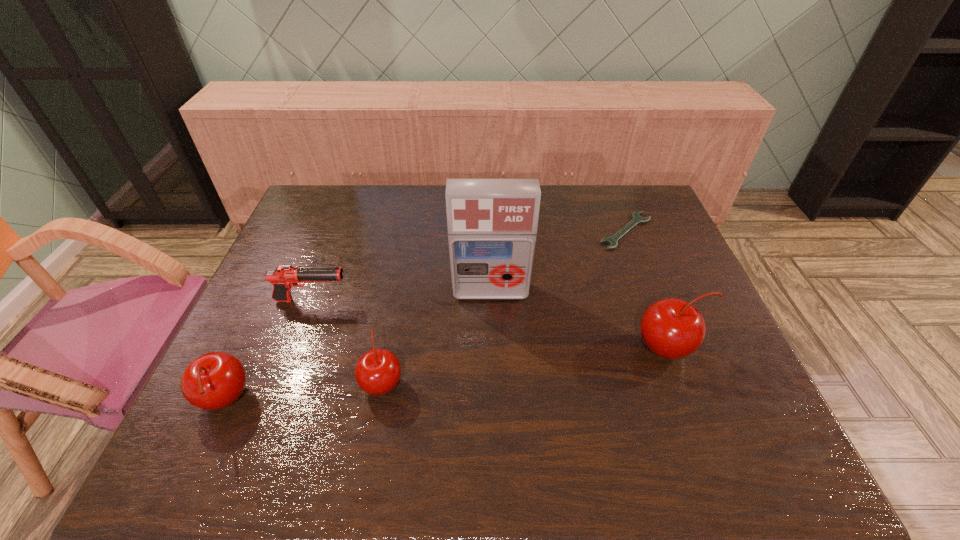
This screenshot has width=960, height=540. I want to click on cherry identified as the second closest to the gun, so click(215, 380).

Find the location of a particular element. Image resolution: width=960 pixels, height=540 pixels. vacant area that satisfies the following two spatial constraints: 1. at the aiming end of the gun; 2. on the left side of the rightmost cherry is located at coordinates (x=294, y=348).

Find the location of a particular element. free spot that satisfies the following two spatial constraints: 1. at the aiming end of the gun; 2. on the right side of the rightmost cherry is located at coordinates (294, 348).

I want to click on free space that satisfies the following two spatial constraints: 1. at the aiming end of the shortest cherry; 2. on the left side of the gun, so click(x=281, y=382).

Find the location of a particular element. This screenshot has width=960, height=540. vacant area in the image that satisfies the following two spatial constraints: 1. on the front-facing side of the first-aid kit; 2. on the right side of the rightmost cherry is located at coordinates (492, 348).